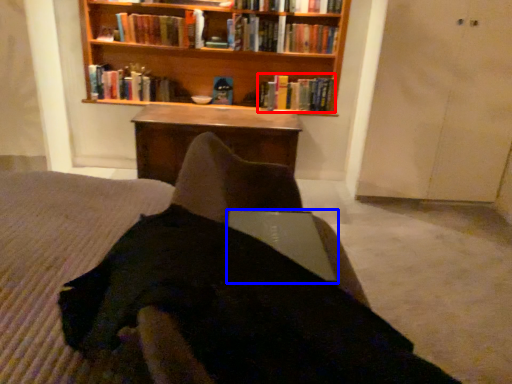
Question: Among these objects, which one is farthest to the camera, book (highlighted by a red box) or laptop (highlighted by a blue box)?

Choices:
 (A) book
 (B) laptop

Answer: (A)